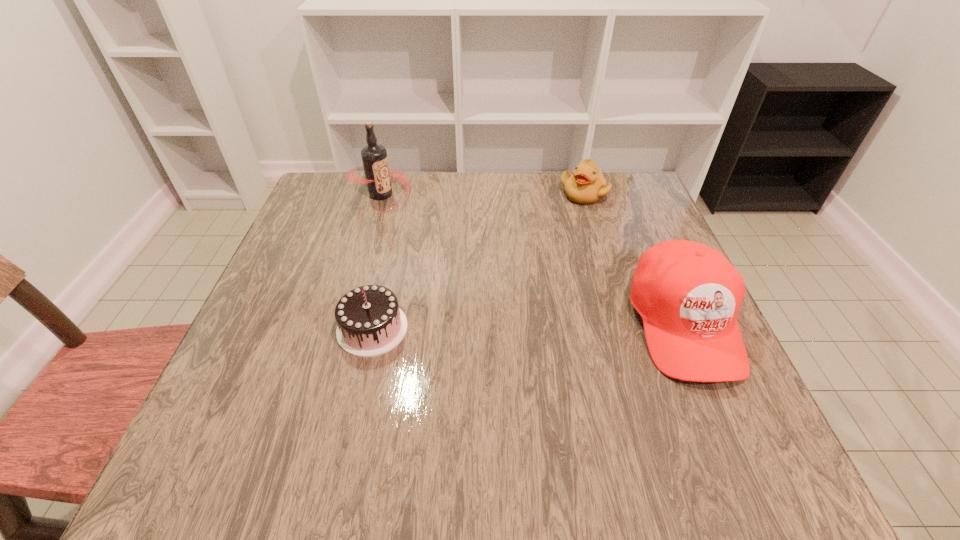
At what (x,y) coordinates should I click in order to perform the action: click on blank space located 0.240m on the label of the tallest object. Please return your answer as a coordinate pair (x, y). The image size is (960, 540). Looking at the image, I should click on (446, 261).

Find the location of a particular element. The height and width of the screenshot is (540, 960). duckling situated at the far edge is located at coordinates (586, 185).

This screenshot has width=960, height=540. I want to click on root beer located at the far edge, so click(x=374, y=157).

Locate an element on the screen. The width and height of the screenshot is (960, 540). object located in the near edge section of the desktop is located at coordinates (688, 294).

Find the location of a particular element. This screenshot has width=960, height=540. object at the left edge is located at coordinates (374, 157).

Where is `baseball cap that is at the right edge`? baseball cap that is at the right edge is located at coordinates (688, 294).

I want to click on duckling located at the right edge, so click(586, 185).

This screenshot has width=960, height=540. Find the location of `object at the far left corner`. object at the far left corner is located at coordinates (374, 157).

Where is `object that is at the far right corner`? This screenshot has width=960, height=540. object that is at the far right corner is located at coordinates (586, 185).

Find the location of a particular element. object located at the near right corner is located at coordinates (688, 294).